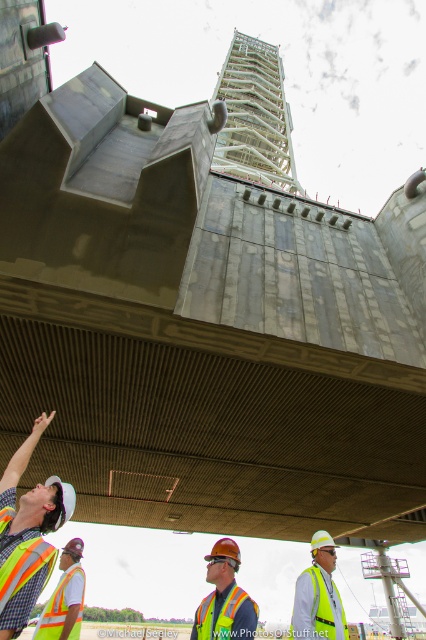
Between white metallic tower at upper center and reflective safety vest at lower left, which one appears on the right side from the viewer's perspective?

white metallic tower at upper center

Looking at this image, does white metallic tower at upper center have a larger size compared to reflective safety vest at lower left?

Yes, white metallic tower at upper center is bigger than reflective safety vest at lower left.

Does point (275, 83) lie in front of point (23, 580)?

That is False.

This screenshot has height=640, width=426. I want to click on white metallic tower at upper center, so click(x=255, y=116).

Can you confirm if reflective safety vest at lower left is positioned to the right of reflective yellow safety vest at center?

In fact, reflective safety vest at lower left is to the left of reflective yellow safety vest at center.

The width and height of the screenshot is (426, 640). What do you see at coordinates (28, 534) in the screenshot? I see `reflective safety vest at lower left` at bounding box center [28, 534].

What are the coordinates of `reflective safety vest at lower left` in the screenshot? It's located at (28, 534).

Does reflective safety vest at lower left appear on the left side of reflective yellow safety vest at lower left?

No, reflective safety vest at lower left is not to the left of reflective yellow safety vest at lower left.

Which is below, reflective safety vest at lower left or reflective yellow safety vest at lower left?

reflective yellow safety vest at lower left is below.

Does point (31, 561) come closer to viewer compared to point (46, 609)?

Yes, it is in front of point (46, 609).

Image resolution: width=426 pixels, height=640 pixels. What are the coordinates of `reflective safety vest at lower left` in the screenshot? It's located at (28, 534).